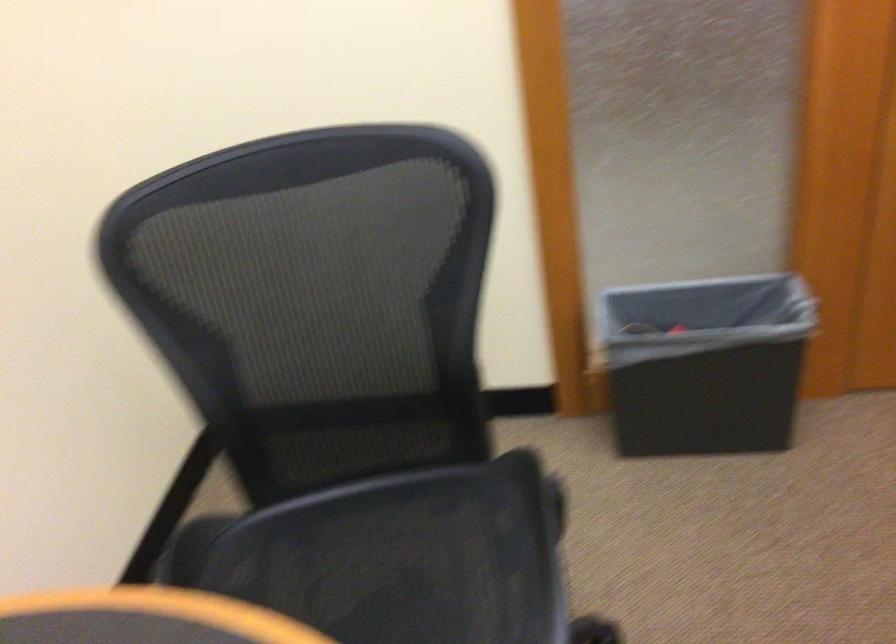
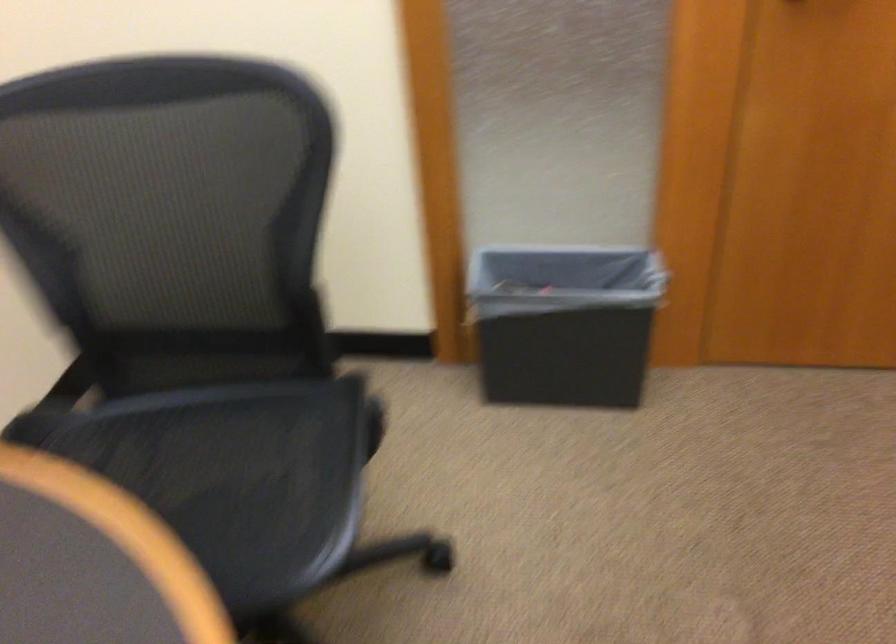
What movement of the cameraman would produce the second image?

The cameraman walked toward right, backward.